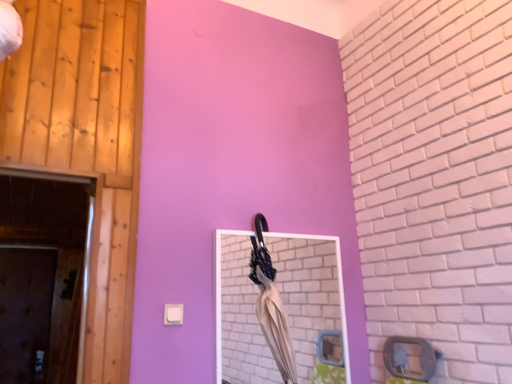
Image resolution: width=512 pixels, height=384 pixels. Describe the element at coordinates (310, 294) in the screenshot. I see `matte white mirror at center` at that location.

Describe the element at coordinates (25, 313) in the screenshot. I see `brown matte door at lower left, which is the second door in right-to-left order` at that location.

You are a GUI agent. You are given a task and a screenshot of the screen. Output one action in this format:
    pyautogui.click(x=<x>, y=<y>)
    Task: Click on the wooden at left, which is counted as the first door, starting from the right
    Image resolution: width=512 pixels, height=384 pixels.
    Given the screenshot: What is the action you would take?
    pyautogui.click(x=85, y=143)

In the scene shown: Is matte white mirror at center completely or partially outside of brown matte door at lower left, the first door when ordered from bottom to top?

Yes, matte white mirror at center is not within brown matte door at lower left, the first door when ordered from bottom to top.

Does matte white mirror at center have a lesser height compared to brown matte door at lower left, the first door when ordered from bottom to top?

Yes.

At what (x,y) coordinates should I click in order to perform the action: click on mirror above the brown matte door at lower left, which is the second door in right-to-left order (from the image's perspective). Please return your answer as a coordinate pair (x, y). The height and width of the screenshot is (384, 512). Looking at the image, I should click on (310, 294).

Who is shorter, matte white mirror at center or beige fabric umbrella at center?

matte white mirror at center.

Which is correct: matte white mirror at center is inside beige fabric umbrella at center, or outside of it?

matte white mirror at center is inside beige fabric umbrella at center.

What's the angular difference between matte white mirror at center and beige fabric umbrella at center's facing directions?

They differ by 1.42 degrees in their facing directions.

From a real-world perspective, is beige fabric umbrella at center beneath brown matte door at lower left, the first door when ordered from bottom to top?

No, from a real-world perspective, beige fabric umbrella at center is not under brown matte door at lower left, the first door when ordered from bottom to top.

Considering the relative sizes of beige fabric umbrella at center and brown matte door at lower left, which ranks as the 1th door in left-to-right order, in the image provided, is beige fabric umbrella at center shorter than brown matte door at lower left, which ranks as the 1th door in left-to-right order,?

Correct, beige fabric umbrella at center is not as tall as brown matte door at lower left, which ranks as the 1th door in left-to-right order.

From the image's perspective, between beige fabric umbrella at center and brown matte door at lower left, which is the second door in right-to-left order, which one is located above?

beige fabric umbrella at center, from the image's perspective.

In terms of width, does beige fabric umbrella at center look wider or thinner when compared to brown matte door at lower left, the first door when ordered from bottom to top?

Considering their sizes, beige fabric umbrella at center looks broader than brown matte door at lower left, the first door when ordered from bottom to top.

Starting from the beige fabric umbrella at center, which door is the 2nd one to the left? Please provide its 2D coordinates.

[(25, 313)]

In the scene shown: From a real-world perspective, is brown matte door at lower left, the second door from the top, positioned above or below beige fabric umbrella at center?

From a real-world perspective, brown matte door at lower left, the second door from the top, is physically below beige fabric umbrella at center.

Which object is positioned more to the left, brown matte door at lower left, which is counted as the first door, starting from the back, or beige fabric umbrella at center?

brown matte door at lower left, which is counted as the first door, starting from the back, is more to the left.

Is there a large distance between brown matte door at lower left, which is counted as the first door, starting from the back, and beige fabric umbrella at center?

Yes, brown matte door at lower left, which is counted as the first door, starting from the back, is far from beige fabric umbrella at center.

Who is smaller, beige fabric umbrella at center or wooden at left, the first door positioned from the front?

With smaller size is beige fabric umbrella at center.

Can you tell me how much beige fabric umbrella at center and wooden at left, arranged as the second door when viewed from the back, differ in facing direction?

They differ by 0.241 degrees in their facing directions.

Is beige fabric umbrella at center looking in the opposite direction of wooden at left, marked as the second door in a left-to-right arrangement?

beige fabric umbrella at center does not have its back to wooden at left, marked as the second door in a left-to-right arrangement.

Which object is closer to the camera taking this photo, beige fabric umbrella at center or wooden at left, which ranks as the second door in bottom-to-top order?

Positioned in front is wooden at left, which ranks as the second door in bottom-to-top order.

The width and height of the screenshot is (512, 384). I want to click on door located behind the wooden at left, which is counted as the first door, starting from the right, so click(25, 313).

Which of these two, brown matte door at lower left, which is counted as the first door, starting from the back, or wooden at left, marked as the second door in a left-to-right arrangement, is smaller?

wooden at left, marked as the second door in a left-to-right arrangement.

Considering the sizes of objects brown matte door at lower left, which is counted as the first door, starting from the back, and wooden at left, which is counted as the first door, starting from the right, in the image provided, who is taller, brown matte door at lower left, which is counted as the first door, starting from the back, or wooden at left, which is counted as the first door, starting from the right,?

wooden at left, which is counted as the first door, starting from the right, is taller.

Can you confirm if brown matte door at lower left, the second door from the top, is positioned to the left of wooden at left, arranged as the second door when viewed from the back?

Indeed, brown matte door at lower left, the second door from the top, is positioned on the left side of wooden at left, arranged as the second door when viewed from the back.

Considering the positions of objects wooden at left, which ranks as the second door in bottom-to-top order, and brown matte door at lower left, the first door when ordered from bottom to top, in the image provided, who is more to the left, wooden at left, which ranks as the second door in bottom-to-top order, or brown matte door at lower left, the first door when ordered from bottom to top,?

From the viewer's perspective, brown matte door at lower left, the first door when ordered from bottom to top, appears more on the left side.

In order to click on door above the brown matte door at lower left, the first door when ordered from bottom to top (from the image's perspective) in this screenshot , I will do `click(85, 143)`.

Considering the positions of point (105, 183) and point (26, 263), is point (105, 183) closer or farther from the camera than point (26, 263)?

Point (105, 183) is positioned closer to the camera compared to point (26, 263).

Does wooden at left, the 1th door when ordered from top to bottom, have a greater width compared to brown matte door at lower left, which ranks as the 1th door in left-to-right order?

No, wooden at left, the 1th door when ordered from top to bottom, is not wider than brown matte door at lower left, which ranks as the 1th door in left-to-right order.

You are a GUI agent. You are given a task and a screenshot of the screen. Output one action in this format:
    pyautogui.click(x=<x>, y=<y>)
    Task: Click on the door below the matte white mirror at center (from the image's perspective)
    The width and height of the screenshot is (512, 384).
    Given the screenshot: What is the action you would take?
    pyautogui.click(x=25, y=313)

You are a GUI agent. You are given a task and a screenshot of the screen. Output one action in this format:
    pyautogui.click(x=<x>, y=<y>)
    Task: Click on the laundry behind the matte white mirror at center
    The width and height of the screenshot is (512, 384).
    Given the screenshot: What is the action you would take?
    pyautogui.click(x=271, y=304)

From the image, which object appears to be nearer to matte white mirror at center, beige fabric umbrella at center or wooden at left, which is counted as the first door, starting from the right?

The object closer to matte white mirror at center is beige fabric umbrella at center.

Which object lies nearer to the anchor point wooden at left, arranged as the second door when viewed from the back, brown matte door at lower left, the second door from the top, or matte white mirror at center?

matte white mirror at center is positioned closer to the anchor wooden at left, arranged as the second door when viewed from the back.

Which object lies nearer to the anchor point beige fabric umbrella at center, wooden at left, marked as the second door in a left-to-right arrangement, or matte white mirror at center?

matte white mirror at center.

From the image, which object appears to be farther from beige fabric umbrella at center, brown matte door at lower left, the first door when ordered from bottom to top, or matte white mirror at center?

Among the two, brown matte door at lower left, the first door when ordered from bottom to top, is located further to beige fabric umbrella at center.

Estimate the real-world distances between objects in this image. Which object is closer to matte white mirror at center, wooden at left, marked as the second door in a left-to-right arrangement, or beige fabric umbrella at center?

beige fabric umbrella at center is closer to matte white mirror at center.

When comparing their distances from brown matte door at lower left, which ranks as the 1th door in left-to-right order, does matte white mirror at center or wooden at left, which is counted as the first door, starting from the right, seem closer?

The object closer to brown matte door at lower left, which ranks as the 1th door in left-to-right order, is matte white mirror at center.

Which object lies further to the anchor point wooden at left, which ranks as the second door in bottom-to-top order, beige fabric umbrella at center or brown matte door at lower left, which is counted as the first door, starting from the back?

brown matte door at lower left, which is counted as the first door, starting from the back.

Estimate the real-world distances between objects in this image. Which object is closer to brown matte door at lower left, the second door viewed from the front, beige fabric umbrella at center or matte white mirror at center?

Among the two, matte white mirror at center is located nearer to brown matte door at lower left, the second door viewed from the front.

Locate an element on the screen. mirror between wooden at left, marked as the second door in a left-to-right arrangement, and brown matte door at lower left, which is the second door in right-to-left order, from front to back is located at coordinates [310, 294].

The height and width of the screenshot is (384, 512). I want to click on laundry between brown matte door at lower left, the first door when ordered from bottom to top, and matte white mirror at center from left to right, so click(271, 304).

Identify the location of laundry between wooden at left, marked as the second door in a left-to-right arrangement, and brown matte door at lower left, which ranks as the 1th door in left-to-right order, from front to back. The height and width of the screenshot is (384, 512). (271, 304).

Locate an element on the screen. laundry between wooden at left, marked as the second door in a left-to-right arrangement, and matte white mirror at center, in the horizontal direction is located at coordinates (271, 304).